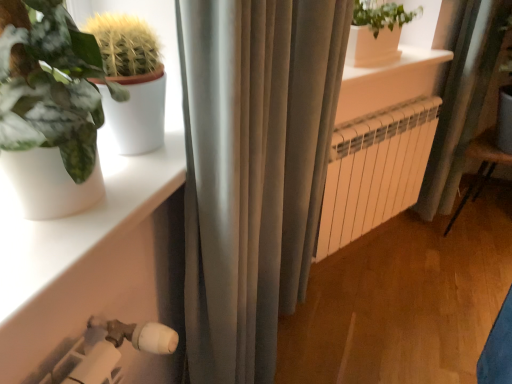
Question: Is wooden armchair at lower right directly adjacent to white matte shelf at lower left?

Choices:
 (A) yes
 (B) no

Answer: (B)

Question: Considering the relative positions of wooden armchair at lower right and white matte shelf at lower left in the image provided, is wooden armchair at lower right in front of white matte shelf at lower left?

Choices:
 (A) yes
 (B) no

Answer: (B)

Question: Can you confirm if wooden armchair at lower right is thinner than white matte shelf at lower left?

Choices:
 (A) no
 (B) yes

Answer: (A)

Question: Does wooden armchair at lower right turn towards white matte shelf at lower left?

Choices:
 (A) yes
 (B) no

Answer: (B)

Question: Is wooden armchair at lower right positioned far away from white matte shelf at lower left?

Choices:
 (A) yes
 (B) no

Answer: (A)

Question: From a real-world perspective, is wooden armchair at lower right located beneath white matte shelf at lower left?

Choices:
 (A) yes
 (B) no

Answer: (A)

Question: Is white smooth window sill at upper center inside white metallic radiator at center?

Choices:
 (A) no
 (B) yes

Answer: (A)

Question: Is white metallic radiator at center far from white smooth window sill at upper center?

Choices:
 (A) no
 (B) yes

Answer: (A)

Question: From a real-world perspective, does white metallic radiator at center stand above white smooth window sill at upper center?

Choices:
 (A) yes
 (B) no

Answer: (B)

Question: From a real-world perspective, is white metallic radiator at center beneath white smooth window sill at upper center?

Choices:
 (A) yes
 (B) no

Answer: (A)

Question: Does white metallic radiator at center lie in front of white smooth window sill at upper center?

Choices:
 (A) no
 (B) yes

Answer: (A)

Question: Is white metallic radiator at center to the right of white smooth window sill at upper center from the viewer's perspective?

Choices:
 (A) no
 (B) yes

Answer: (B)

Question: From the image's perspective, is white smooth window sill at upper center below white metallic radiator at center?

Choices:
 (A) no
 (B) yes

Answer: (A)